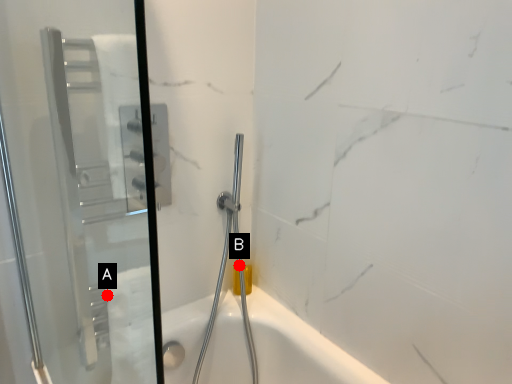
Question: Two points are circled on the image, labeled by A and B beside each circle. Which point appears closest to the camera in this image?

Choices:
 (A) A is closer
 (B) B is closer

Answer: (A)